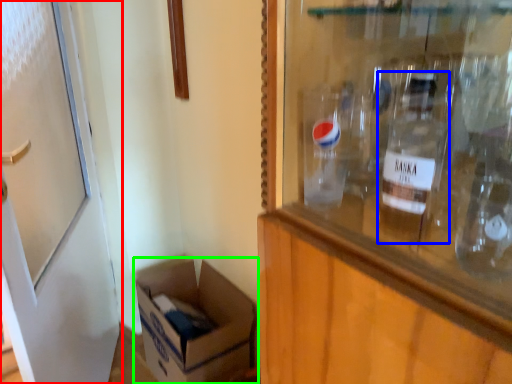
Question: Considering the real-world distances, which object is farthest from door (highlighted by a red box)? bottle (highlighted by a blue box) or box (highlighted by a green box)?

Choices:
 (A) bottle
 (B) box

Answer: (A)